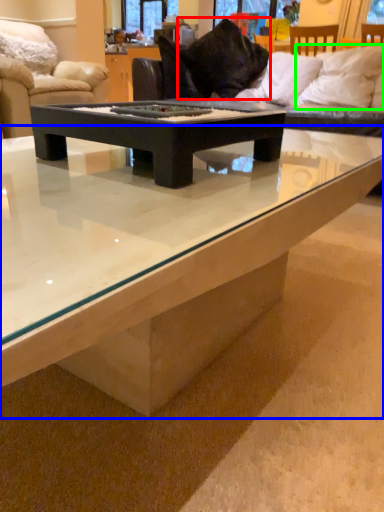
Question: Based on their relative distances, which object is nearer to pillow (highlighted by a red box)? Choose from coffee table (highlighted by a blue box) and pillow (highlighted by a green box).

Choices:
 (A) coffee table
 (B) pillow

Answer: (B)